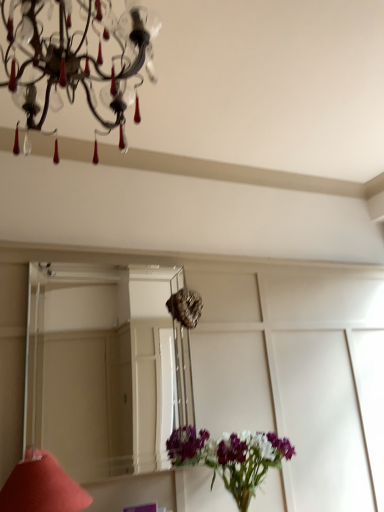
Question: Would you say crystal glass chandelier at upper left is to the left or to the right of clear glass mirror at center in the picture?

Choices:
 (A) right
 (B) left

Answer: (A)

Question: From the image's perspective, is crystal glass chandelier at upper left positioned above or below clear glass mirror at center?

Choices:
 (A) above
 (B) below

Answer: (A)

Question: Which of these objects is positioned farthest from the matte red cone at lower left?

Choices:
 (A) crystal glass chandelier at upper left
 (B) clear glass mirror at center

Answer: (B)

Question: Considering the real-world distances, which object is closest to the crystal glass chandelier at upper left?

Choices:
 (A) matte red cone at lower left
 (B) clear glass mirror at center

Answer: (A)